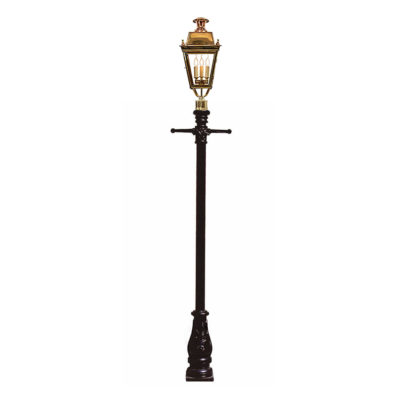
I want to click on light bulbs, so click(195, 62), click(202, 61), click(207, 60).